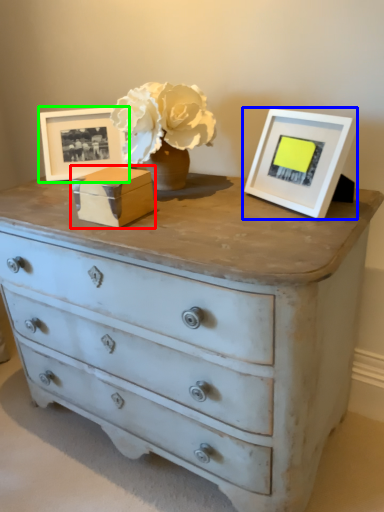
Question: Which object is the closest to the box (highlighted by a red box)? Choose among these: picture frame (highlighted by a blue box) or picture frame (highlighted by a green box).

Choices:
 (A) picture frame
 (B) picture frame

Answer: (B)